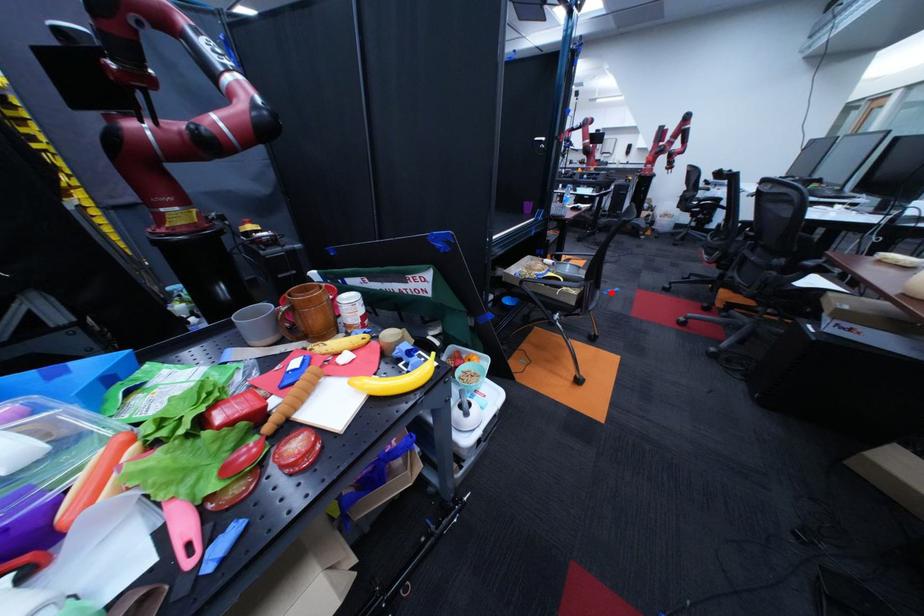
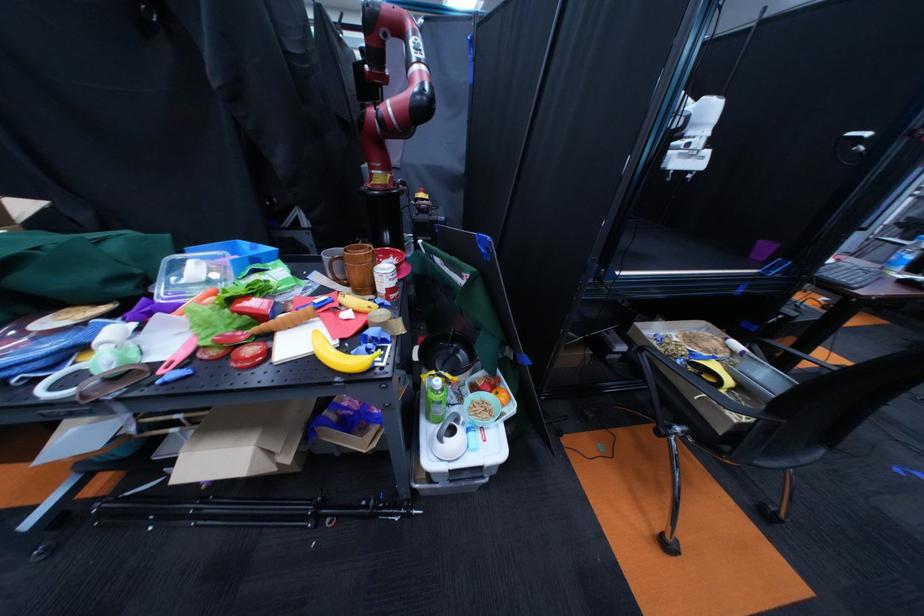
The point at the highlighted location is marked in the first image. Where is the corresponding point in the second image?

(835, 451)